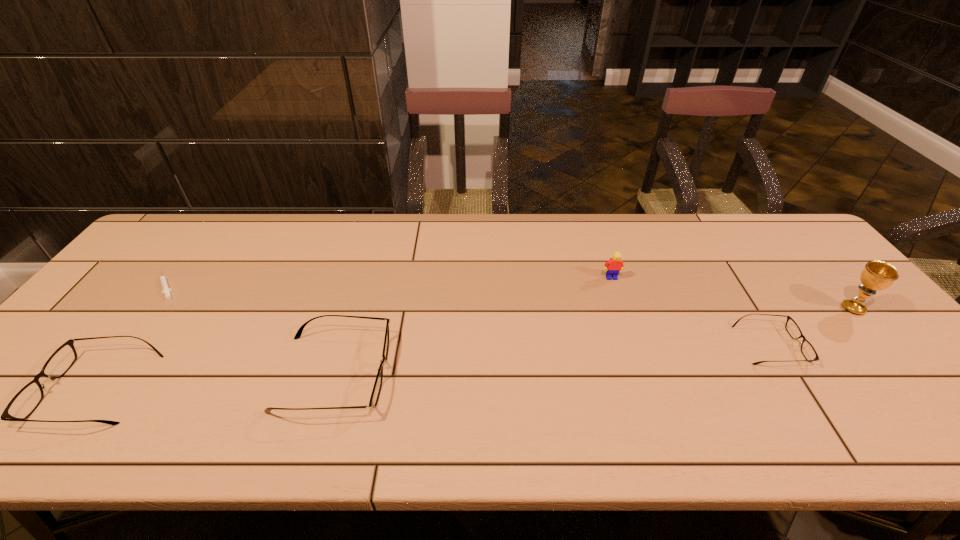
Image resolution: width=960 pixels, height=540 pixels. What are the coordinates of `vacant position located on the front-facing side of the leftmost spectacles` in the screenshot? It's located at (26, 388).

At what (x,y) coordinates should I click in order to perform the action: click on vacant position located on the front-facing side of the leftmost spectacles. Please return your answer as a coordinate pair (x, y). Image resolution: width=960 pixels, height=540 pixels. Looking at the image, I should click on (26, 388).

Find the location of `free location located 0.070m on the front-facing side of the third object from left to right`. free location located 0.070m on the front-facing side of the third object from left to right is located at coordinates (419, 373).

Where is `free location located 0.060m on the front-facing side of the fifth object from left to right`? This screenshot has height=540, width=960. free location located 0.060m on the front-facing side of the fifth object from left to right is located at coordinates click(x=824, y=345).

Where is `vacant space situated on the front-facing side of the fourth object from left to right`? The height and width of the screenshot is (540, 960). vacant space situated on the front-facing side of the fourth object from left to right is located at coordinates (623, 313).

Where is `vacant region located on the back of the syringe`? vacant region located on the back of the syringe is located at coordinates (215, 224).

Locate an element on the screen. This screenshot has height=540, width=960. vacant space located 0.150m on the back of the tallest object is located at coordinates (814, 264).

At what (x,y) coordinates should I click in order to perform the action: click on spectacles that is at the left edge. Please return your answer as a coordinate pair (x, y). Looking at the image, I should click on (23, 404).

Identify the location of syringe present at the left edge. (166, 290).

At what (x,y) coordinates should I click in order to perform the action: click on object located at the right edge. Please return your answer as a coordinate pair (x, y). Looking at the image, I should click on (877, 275).